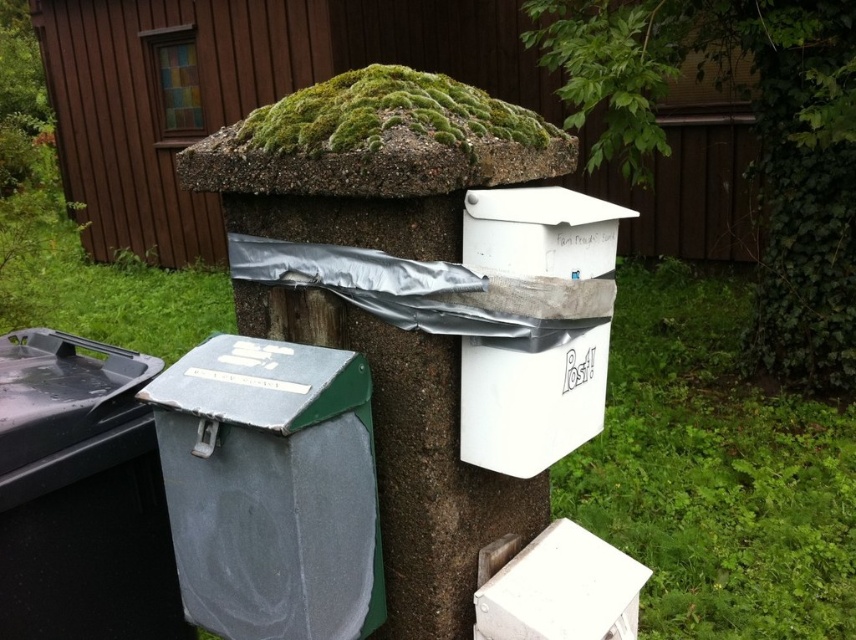
Question: Which point is farther to the camera?

Choices:
 (A) [348, 461]
 (B) [794, 166]
 (C) [149, 504]

Answer: (B)

Question: Does metallic gray recycling bin at lower left appear under black plastic bin at lower left?

Choices:
 (A) no
 (B) yes

Answer: (B)

Question: Does green mossy tree at upper center come behind black plastic bin at lower left?

Choices:
 (A) yes
 (B) no

Answer: (A)

Question: Considering the real-world distances, which object is farthest from the black plastic bin at lower left?

Choices:
 (A) green mossy tree at upper center
 (B) metallic gray recycling bin at lower left

Answer: (A)

Question: Can you confirm if metallic gray recycling bin at lower left is wider than black plastic bin at lower left?

Choices:
 (A) no
 (B) yes

Answer: (A)

Question: Which point is closer to the camera?

Choices:
 (A) (819, 291)
 (B) (91, 346)

Answer: (B)